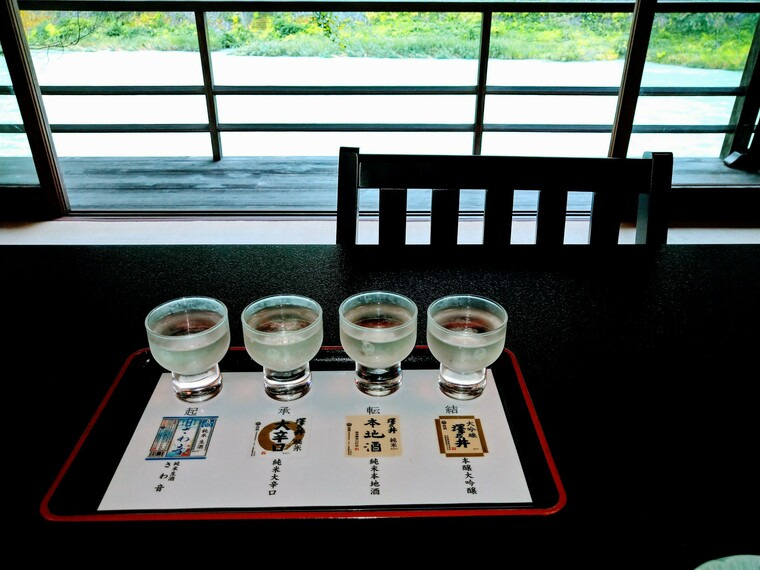
Image resolution: width=760 pixels, height=570 pixels. Identify the location of window. (280, 61).